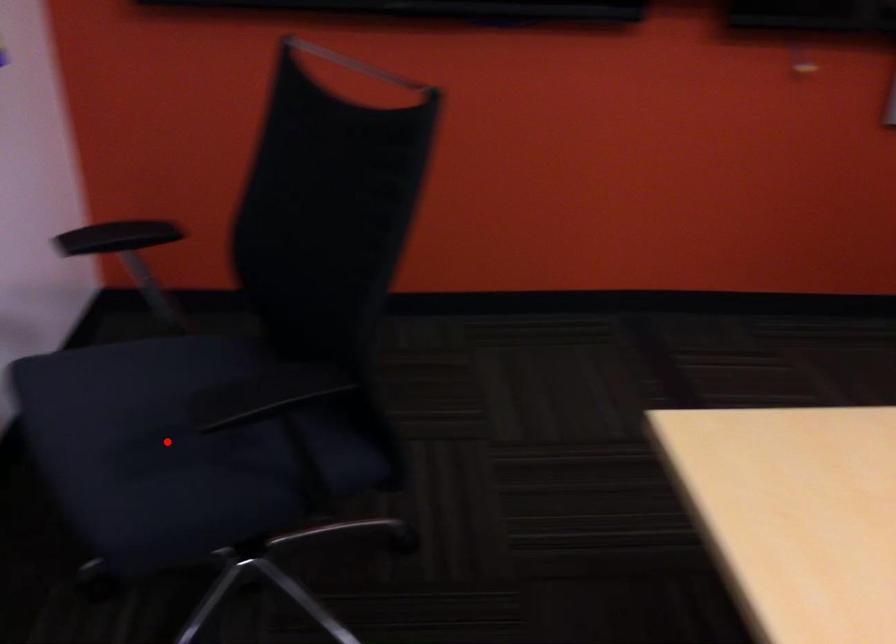
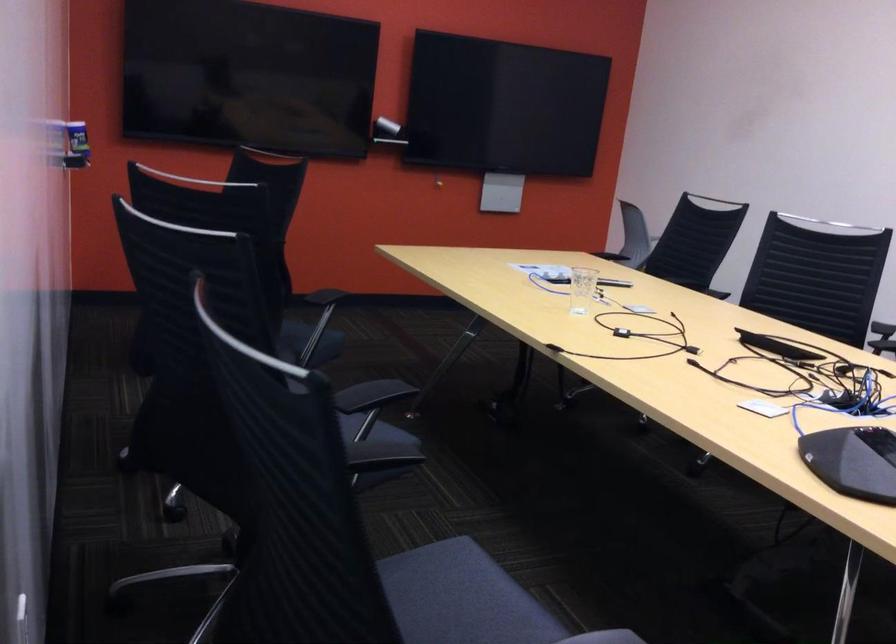
Question: I am providing you with two images of the same scene from different viewpoints. A red point is marked on the first image. Can you still see the location of the red point in image 2?

Choices:
 (A) Yes
 (B) No

Answer: (B)